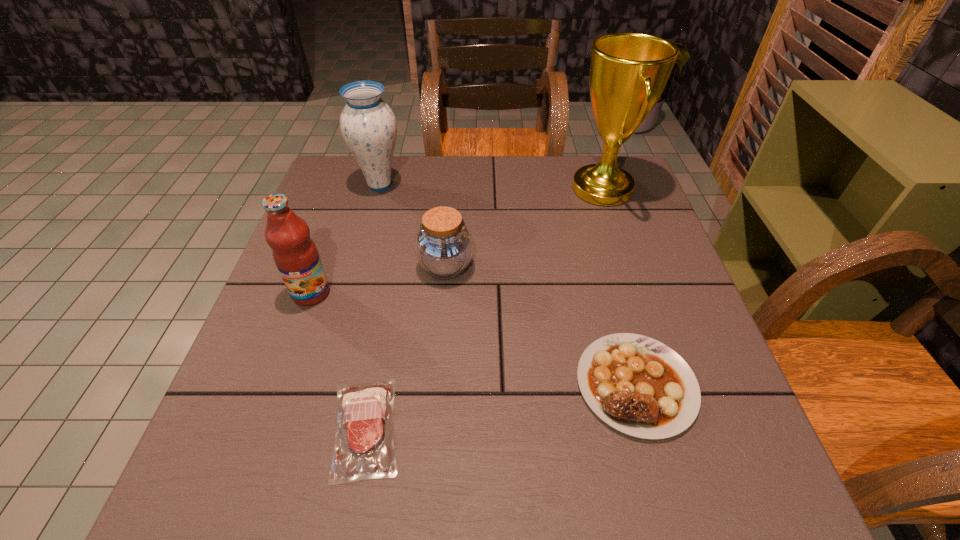
The image size is (960, 540). I want to click on vacant area that lies between the vase and the right steak, so click(508, 285).

The height and width of the screenshot is (540, 960). I want to click on free space between the shortest object and the vase, so click(372, 307).

Locate an element on the screen. The height and width of the screenshot is (540, 960). empty space between the shortest object and the vase is located at coordinates [x=372, y=307].

Locate an element on the screen. empty space between the shorter steak and the second shortest object is located at coordinates (500, 407).

Find the location of a particular element. This screenshot has height=540, width=960. vacant point located between the third shortest object and the tallest object is located at coordinates (524, 227).

In order to click on free space that is in between the tallest object and the jar in this screenshot , I will do `click(524, 227)`.

At what (x,y) coordinates should I click in order to perform the action: click on vacant area that lies between the award and the left steak. Please return your answer as a coordinate pair (x, y). This screenshot has width=960, height=540. Looking at the image, I should click on (484, 308).

Where is `empty location between the second shortest object and the shorter steak`? The width and height of the screenshot is (960, 540). empty location between the second shortest object and the shorter steak is located at coordinates (500, 407).

Identify the location of vacant area that lies between the award and the vase. (492, 187).

Locate an element on the screen. Image resolution: width=960 pixels, height=540 pixels. object that ranks as the second closest to the fruit juice is located at coordinates (364, 448).